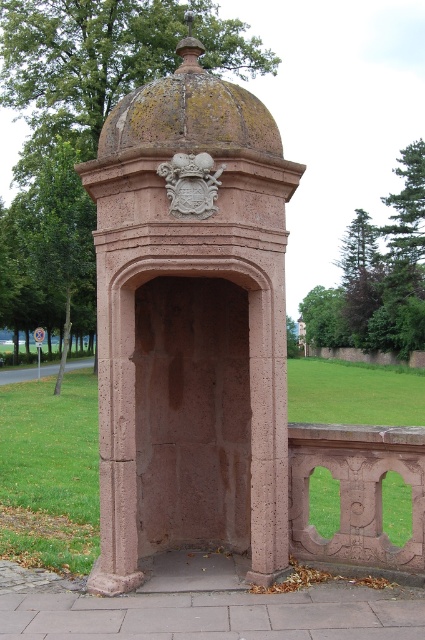
You are standing at the point marked by coordinates point (190, 323). Based on the scene, what structure are you directly in front of?

The point (190, 323) indicates rustic stone gazebo at center, so you are directly in front of the rustic stone gazebo at center.